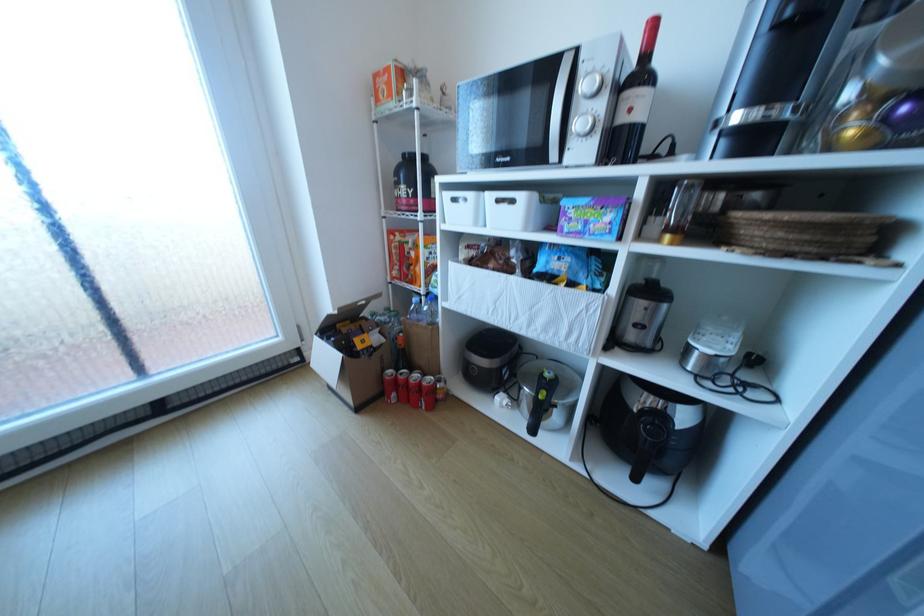
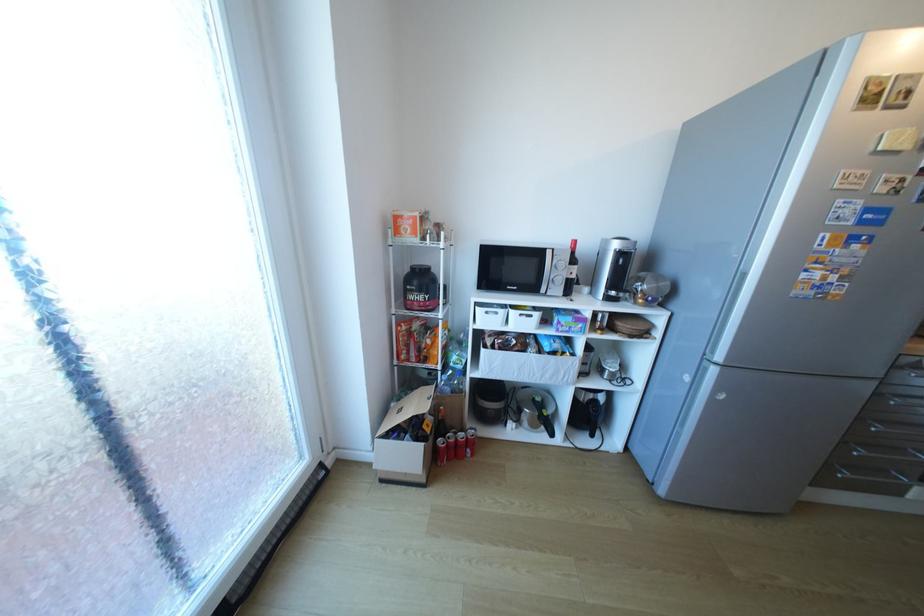
Locate, in the second image, the point that corresponds to (x=440, y=326) in the first image.

(472, 394)